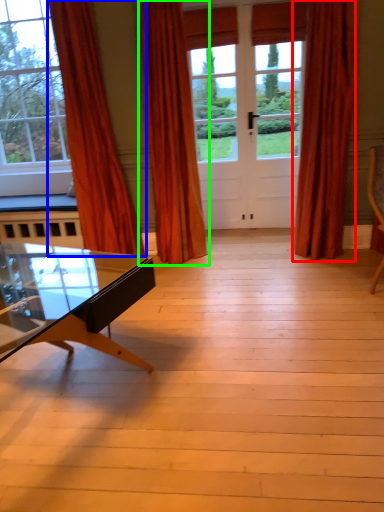
Question: Considering the real-world distances, which object is closest to curtain (highlighted by a red box)? curtain (highlighted by a blue box) or curtain (highlighted by a green box).

Choices:
 (A) curtain
 (B) curtain

Answer: (B)